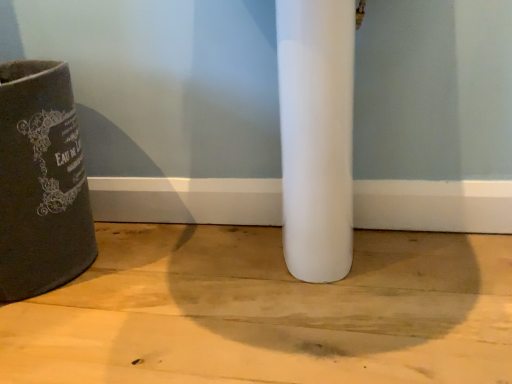
You are a GUI agent. You are given a task and a screenshot of the screen. Output one action in this format:
    pyautogui.click(x=<x>, y=<y>)
    Task: Click on the dark gray fabric waste container at left
    This screenshot has height=384, width=512.
    Given the screenshot: What is the action you would take?
    pyautogui.click(x=41, y=182)

In the scene shown: What is the approximate width of dark gray fabric waste container at left?

dark gray fabric waste container at left is 17.52 inches in width.

Image resolution: width=512 pixels, height=384 pixels. What do you see at coordinates (41, 182) in the screenshot?
I see `dark gray fabric waste container at left` at bounding box center [41, 182].

What do you see at coordinates (268, 312) in the screenshot? The image size is (512, 384). I see `white matte concrete at center` at bounding box center [268, 312].

The width and height of the screenshot is (512, 384). What are the coordinates of `white matte concrete at center` in the screenshot? It's located at (268, 312).

At what (x,y) coordinates should I click in order to perform the action: click on dark gray fabric waste container at left. Please return your answer as a coordinate pair (x, y). The width and height of the screenshot is (512, 384). Looking at the image, I should click on pyautogui.click(x=41, y=182).

Considering the positions of objects white matte concrete at center and dark gray fabric waste container at left in the image provided, who is more to the right, white matte concrete at center or dark gray fabric waste container at left?

From the viewer's perspective, white matte concrete at center appears more on the right side.

Is white matte concrete at center positioned in front of dark gray fabric waste container at left?

That is True.

Is point (81, 352) positioned behind point (59, 169)?

No, (81, 352) is closer to viewer.

From the image's perspective, which is above, white matte concrete at center or dark gray fabric waste container at left?

dark gray fabric waste container at left appears higher in the image.

From a real-world perspective, is white matte concrete at center physically located above or below dark gray fabric waste container at left?

In terms of real-world spatial position, white matte concrete at center is below dark gray fabric waste container at left.

In the scene shown: Which of these two, white matte concrete at center or dark gray fabric waste container at left, is thinner?

dark gray fabric waste container at left is thinner.

Considering the sizes of white matte concrete at center and dark gray fabric waste container at left in the image, is white matte concrete at center taller or shorter than dark gray fabric waste container at left?

Considering their sizes, white matte concrete at center has less height than dark gray fabric waste container at left.

Which of these two, white matte concrete at center or dark gray fabric waste container at left, is smaller?

white matte concrete at center.

Would you say white matte concrete at center is inside or outside dark gray fabric waste container at left?

white matte concrete at center is not enclosed by dark gray fabric waste container at left.

Would you consider white matte concrete at center to be distant from dark gray fabric waste container at left?

That's not correct — white matte concrete at center is a little close to dark gray fabric waste container at left.

Is white matte concrete at center positioned with its back to dark gray fabric waste container at left?

No, white matte concrete at center is not facing away from dark gray fabric waste container at left.

How different are the orientations of white matte concrete at center and dark gray fabric waste container at left in degrees?

They differ by 2.99 degrees in their facing directions.

You are a GUI agent. You are given a task and a screenshot of the screen. Output one action in this format:
    pyautogui.click(x=<x>, y=<y>)
    Task: Click on the waste container that is behind the white matte concrete at center
    This screenshot has width=512, height=384.
    Given the screenshot: What is the action you would take?
    pyautogui.click(x=41, y=182)

Which is more to the left, dark gray fabric waste container at left or white matte concrete at center?

dark gray fabric waste container at left is more to the left.

Is dark gray fabric waste container at left behind white matte concrete at center?

Yes, dark gray fabric waste container at left is behind white matte concrete at center.

Is point (67, 112) closer to viewer compared to point (354, 351)?

No, it is not.

From the image's perspective, does dark gray fabric waste container at left appear lower than white matte concrete at center?

Incorrect, from the image's perspective, dark gray fabric waste container at left is higher than white matte concrete at center.

Consider the image. From a real-world perspective, is dark gray fabric waste container at left physically located above or below white matte concrete at center?

Clearly, from a real-world perspective, dark gray fabric waste container at left is above white matte concrete at center.

Does dark gray fabric waste container at left have a greater width compared to white matte concrete at center?

Incorrect, the width of dark gray fabric waste container at left does not surpass that of white matte concrete at center.

Considering the sizes of objects dark gray fabric waste container at left and white matte concrete at center in the image provided, who is shorter, dark gray fabric waste container at left or white matte concrete at center?

white matte concrete at center.

Can you confirm if dark gray fabric waste container at left is smaller than white matte concrete at center?

Incorrect, dark gray fabric waste container at left is not smaller in size than white matte concrete at center.

Would you say dark gray fabric waste container at left is inside or outside white matte concrete at center?

dark gray fabric waste container at left is located beyond the bounds of white matte concrete at center.

Are dark gray fabric waste container at left and white matte concrete at center beside each other?

dark gray fabric waste container at left and white matte concrete at center are clearly separated.

Is dark gray fabric waste container at left turned away from white matte concrete at center?

No, dark gray fabric waste container at left's orientation is not away from white matte concrete at center.

The image size is (512, 384). I want to click on concrete that is in front of the dark gray fabric waste container at left, so click(x=268, y=312).

Locate an element on the screen. Image resolution: width=512 pixels, height=384 pixels. waste container to the left of white matte concrete at center is located at coordinates (41, 182).

The height and width of the screenshot is (384, 512). I want to click on waste container that appears behind the white matte concrete at center, so click(x=41, y=182).